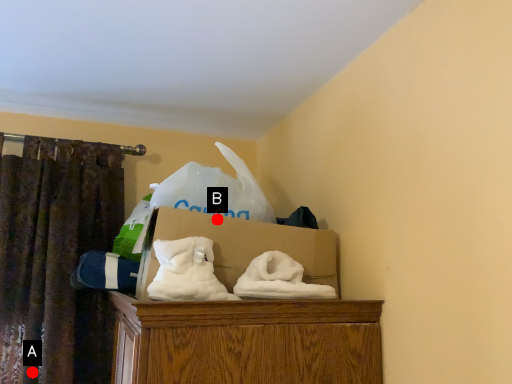
Question: Two points are circled on the image, labeled by A and B beside each circle. Among these points, which one is farthest from the camera?

Choices:
 (A) A is further
 (B) B is further

Answer: (A)